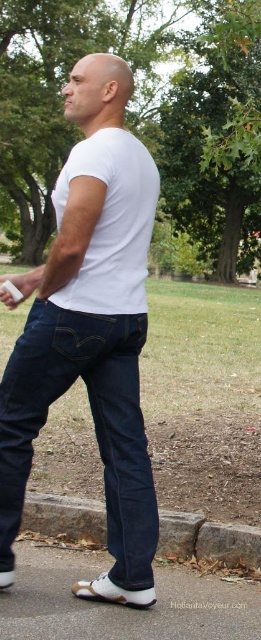
Can you confirm if white matte t-shirt at center is bigger than gray concrete curb at lower center?

Yes, white matte t-shirt at center is bigger than gray concrete curb at lower center.

Does point (8, 536) come closer to viewer compared to point (104, 528)?

That is True.

Who is more distant from viewer, (115, 506) or (46, 524)?

Positioned behind is point (46, 524).

Where is `white matte t-shirt at center`? white matte t-shirt at center is located at coordinates (91, 330).